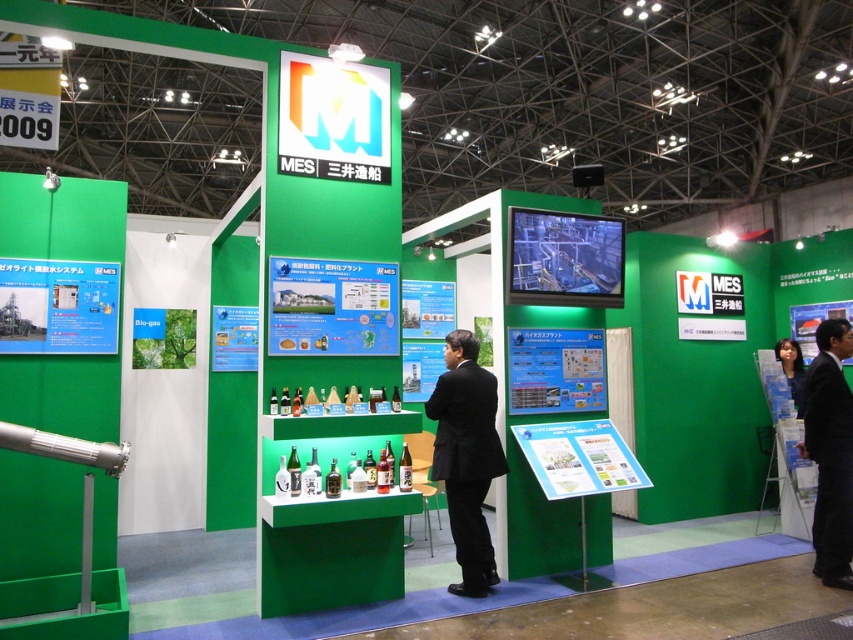
Question: Does black suit at center appear over matte black hair at lower right?

Choices:
 (A) yes
 (B) no

Answer: (B)

Question: Can you confirm if black suit at center is positioned to the left of black suit at right?

Choices:
 (A) no
 (B) yes

Answer: (B)

Question: Which point is farther to the camera?

Choices:
 (A) (834, 420)
 (B) (488, 371)
 (C) (796, 378)

Answer: (C)

Question: Which object is positioned closest to the black suit at center?

Choices:
 (A) black suit at right
 (B) matte black hair at lower right

Answer: (A)

Question: Among these objects, which one is farthest from the camera?

Choices:
 (A) black suit at center
 (B) black suit at right

Answer: (B)

Question: Does black suit at center lie in front of matte black hair at lower right?

Choices:
 (A) no
 (B) yes

Answer: (B)